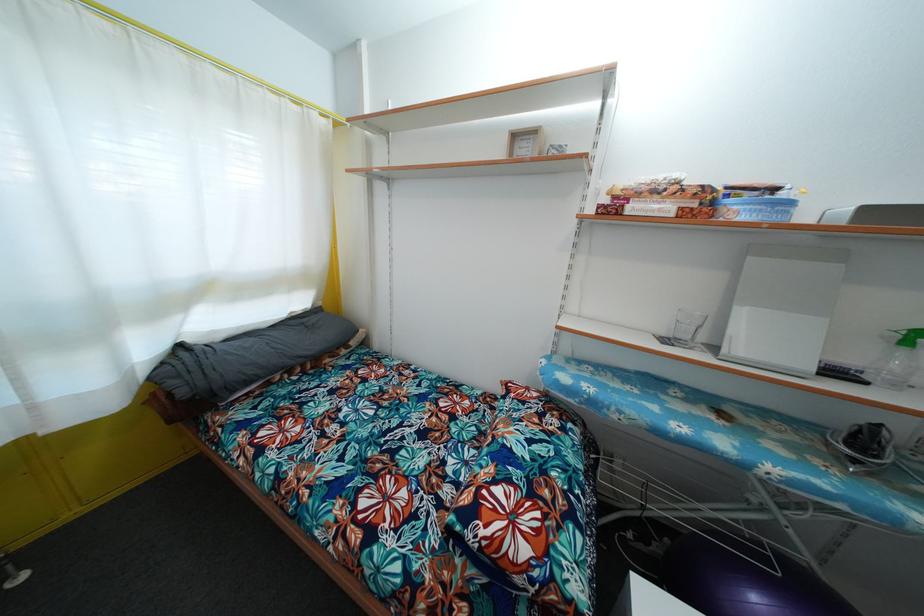
The height and width of the screenshot is (616, 924). What are the coordinates of `food package` in the screenshot? It's located at click(x=661, y=200).